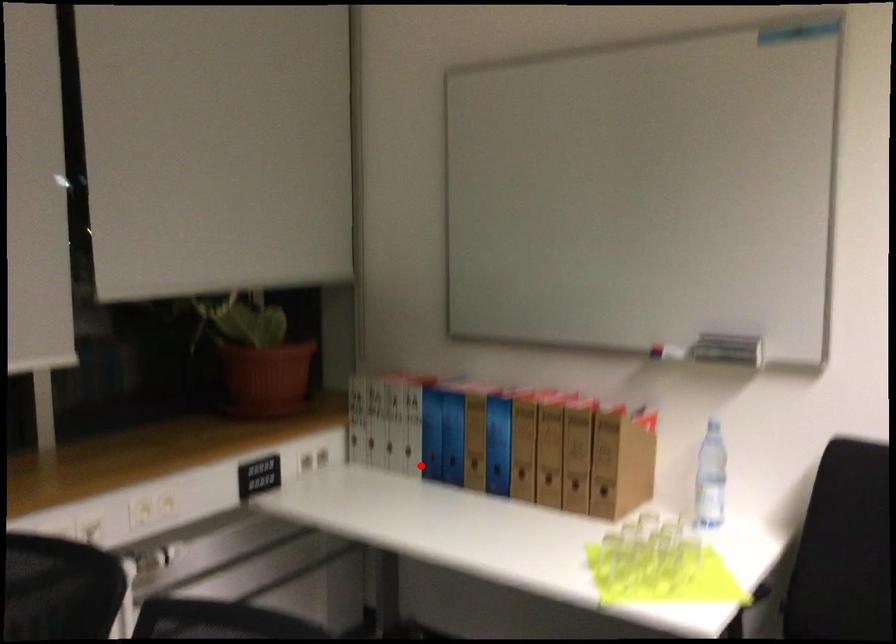
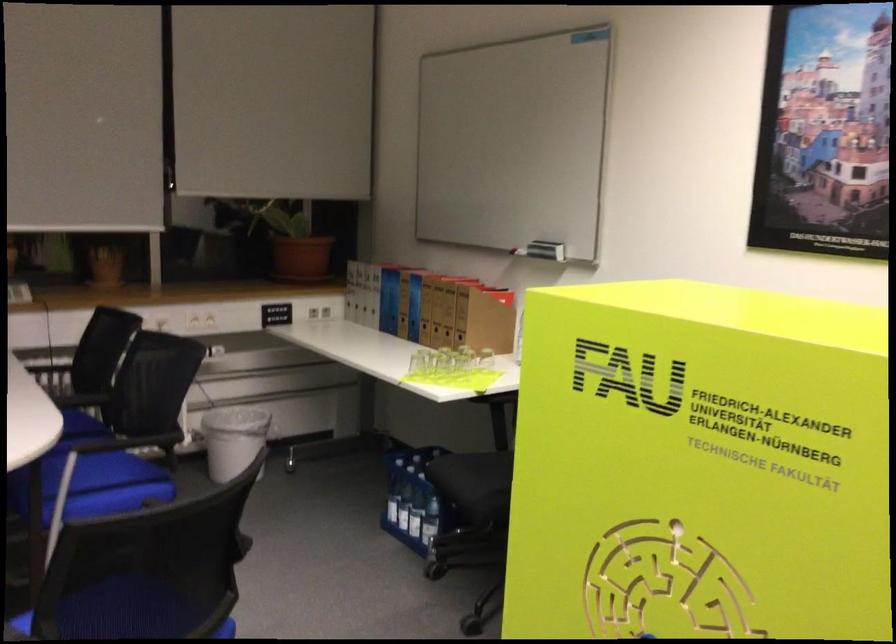
In the second image, find the point that corresponds to the highlighted location in the first image.

(382, 321)